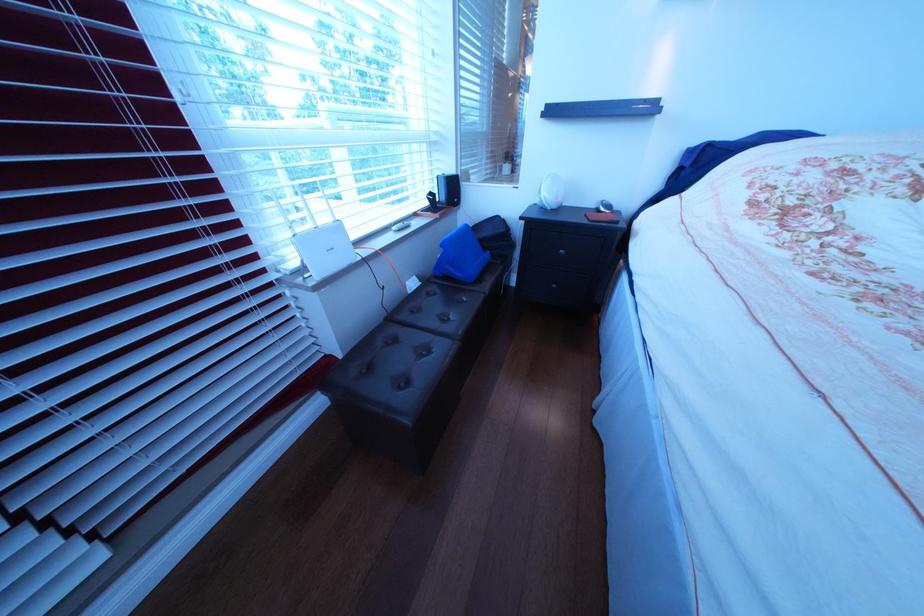
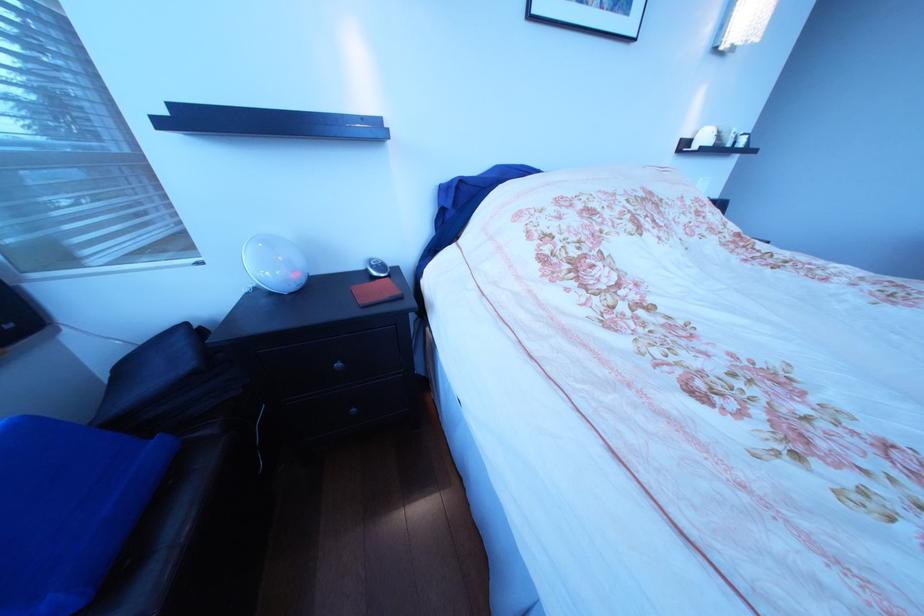
The point at (551, 207) is marked in the first image. Where is the corresponding point in the second image?

(272, 291)